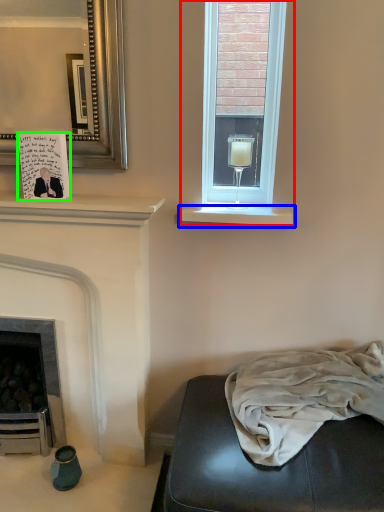
Question: Which is farther away from window (highlighted by a red box)? window sill (highlighted by a blue box) or postcard (highlighted by a green box)?

Choices:
 (A) window sill
 (B) postcard

Answer: (B)